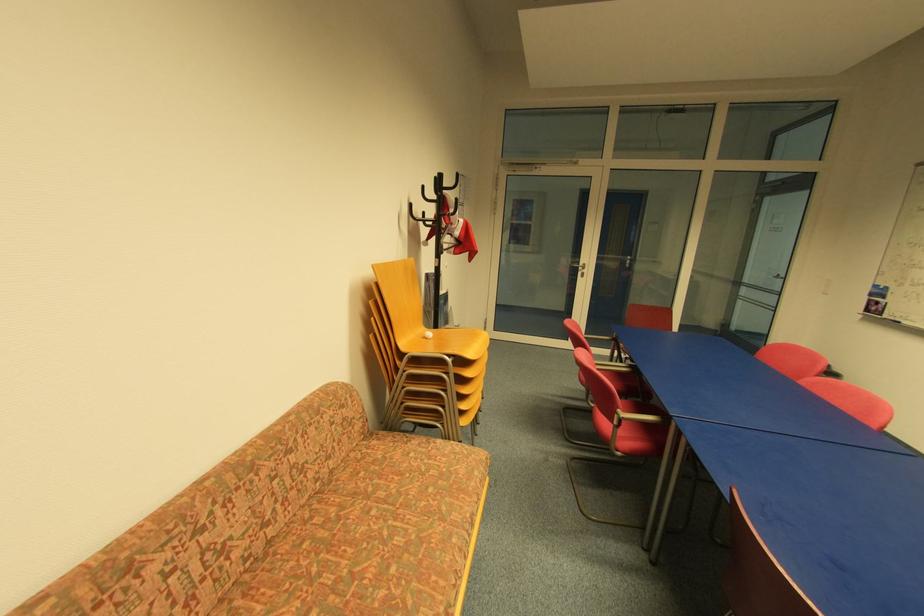
Locate an element on the screen. Image resolution: width=924 pixels, height=616 pixels. sofa sitting surface is located at coordinates (381, 532).